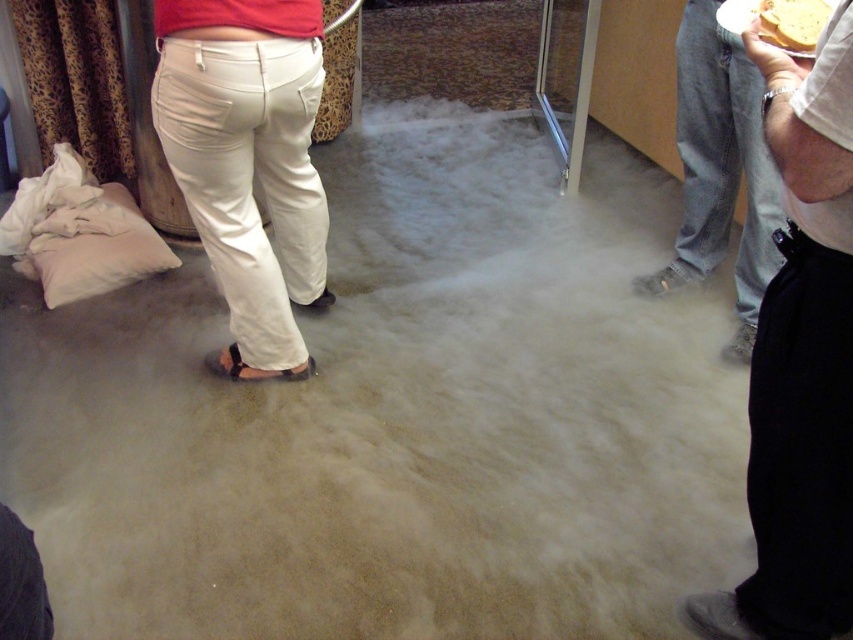
Does denim jeans at right have a smaller size compared to yellow bread at upper right?

No.

Where is `denim jeans at right`? The width and height of the screenshot is (853, 640). denim jeans at right is located at coordinates (720, 170).

Which is in front, point (24, 269) or point (312, 371)?

Point (312, 371) is in front.

Does point (51, 237) lie in front of point (276, 371)?

No, it is not.

At what (x,y) coordinates should I click in order to perform the action: click on beige fabric pillow at left. Please return your answer as a coordinate pair (x, y). This screenshot has height=640, width=853. Looking at the image, I should click on (94, 246).

Can you confirm if white cotton pants at lower left is positioned above denim jeans at right?

Actually, white cotton pants at lower left is below denim jeans at right.

Can you confirm if white cotton pants at lower left is positioned below denim jeans at right?

Yes, white cotton pants at lower left is below denim jeans at right.

Does point (247, 22) lie behind point (691, 113)?

That is False.

At what (x,y) coordinates should I click in order to perform the action: click on white cotton pants at lower left. Please return your answer as a coordinate pair (x, y). Looking at the image, I should click on (247, 161).